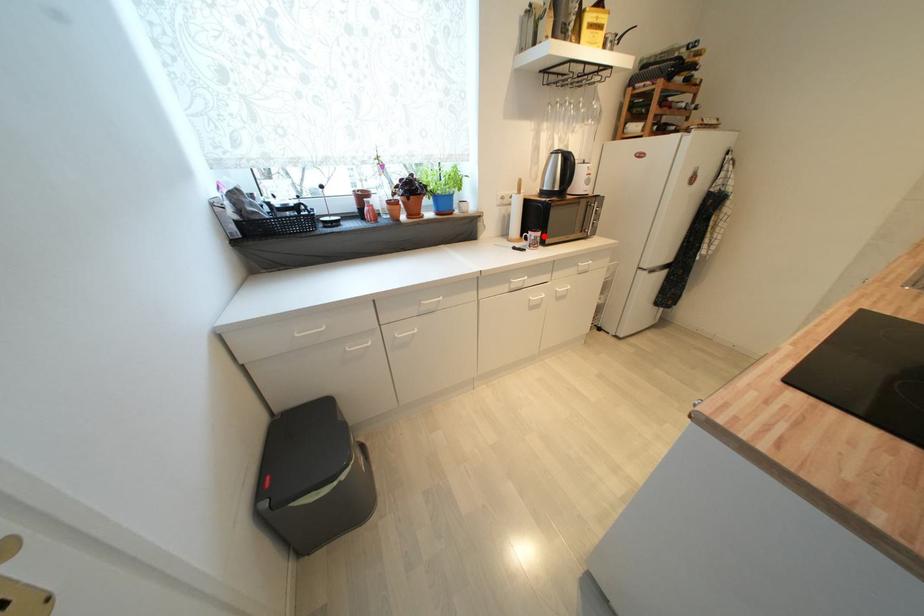
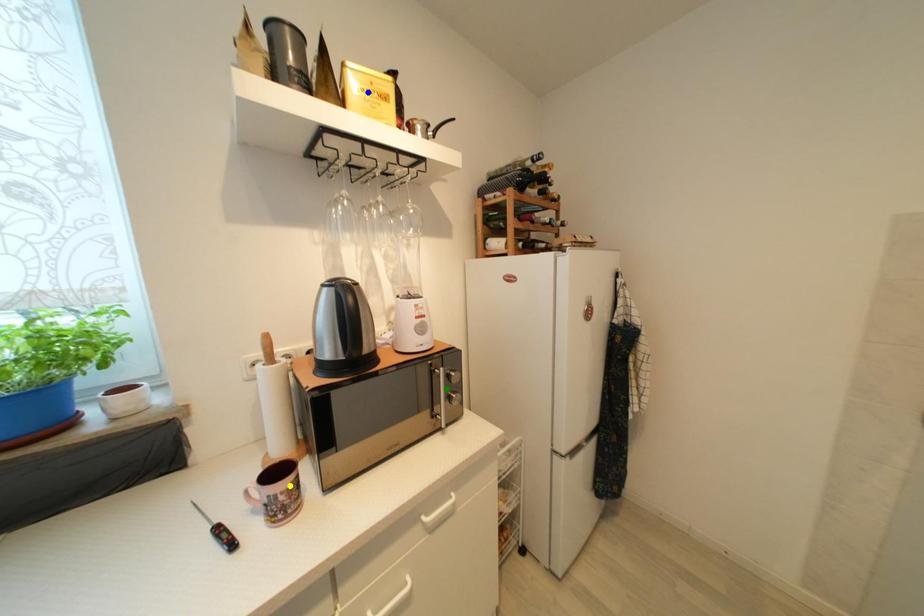
Question: I am providing you with two images of the same scene from different viewpoints. A red point is marked on the first image. You are given multiple points on the second image. Which point in image 2 is actually the same real-world point as the red point in image 1?

Choices:
 (A) yellow point
 (B) green point
 (C) blue point

Answer: (A)